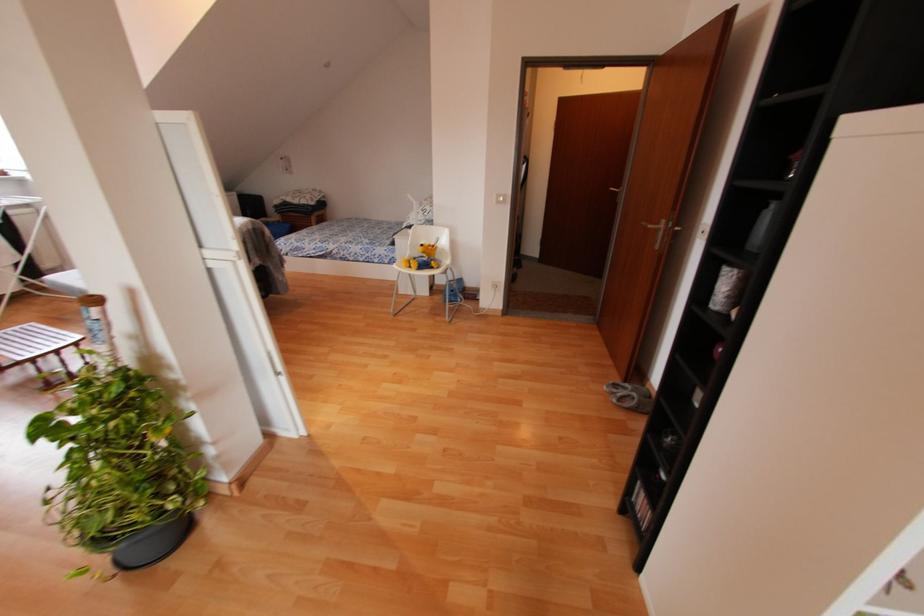
Which object does [152,543] point to?

It corresponds to the black plant pot in the image.